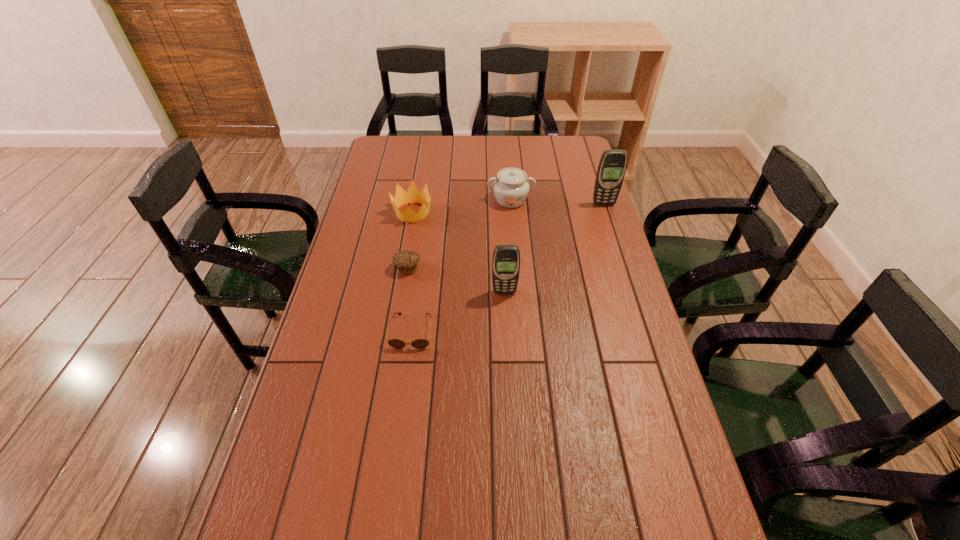
This screenshot has width=960, height=540. Identify the location of vacant space located 0.190m on the screen of the nearer cellular telephone. (507, 346).

This screenshot has height=540, width=960. Find the location of `blank area located 0.190m on the screen of the farther cellular telephone`. blank area located 0.190m on the screen of the farther cellular telephone is located at coordinates (614, 239).

I want to click on free spot located 0.170m on the back of the crown, so click(x=420, y=175).

Image resolution: width=960 pixels, height=540 pixels. Find the location of `vacant area situated 0.100m on the lenses of the nearest object`. vacant area situated 0.100m on the lenses of the nearest object is located at coordinates (405, 382).

Locate an element on the screen. Image resolution: width=960 pixels, height=540 pixels. vacant space located on the front of the muffin is located at coordinates (387, 390).

Locate an element on the screen. This screenshot has height=540, width=960. free space located 0.230m on the left of the chinaware is located at coordinates (426, 200).

Find the location of `object present at the left edge`. object present at the left edge is located at coordinates (413, 195).

The image size is (960, 540). Find the location of `object located at the right edge`. object located at the right edge is located at coordinates (612, 166).

At what (x,y) coordinates should I click in order to perform the action: click on free region at the far edge of the desktop. Please return your answer as a coordinate pair (x, y). The width and height of the screenshot is (960, 540). Looking at the image, I should click on (446, 145).

I want to click on vacant space at the left edge of the desktop, so click(x=355, y=267).